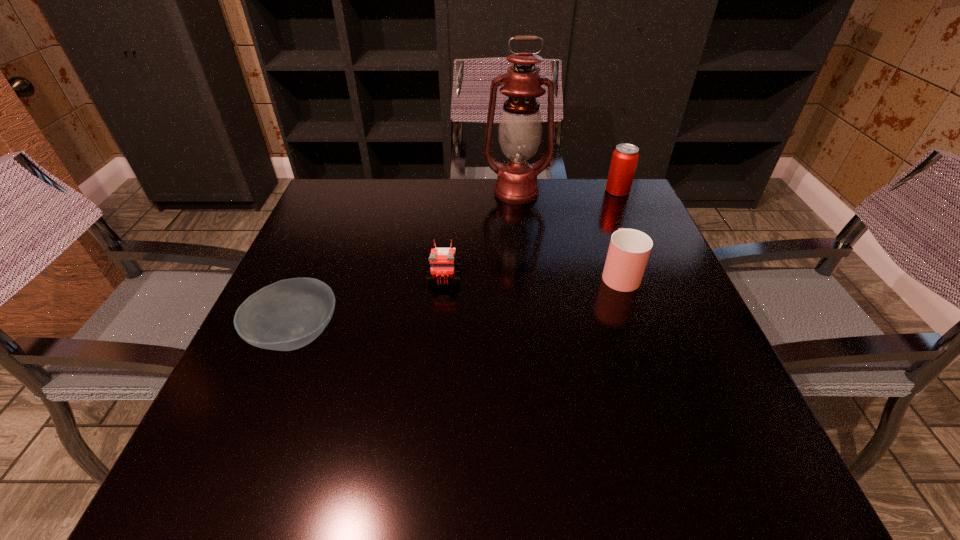
At what (x,y) coordinates should I click in order to perform the action: click on free point between the second object from right to left and the nearest object. Please return your answer as a coordinate pair (x, y). Looking at the image, I should click on (458, 304).

The width and height of the screenshot is (960, 540). Identify the location of vacant point located between the fourth shortest object and the oil lamp. (567, 192).

Identify the location of vacant region between the second object from left to right and the tallest object. (480, 234).

At what (x,y) coordinates should I click in order to perform the action: click on free area in between the fourth object from right to left and the nearest object. Please return your answer as a coordinate pair (x, y). This screenshot has height=540, width=960. Looking at the image, I should click on (371, 306).

Find the location of a particular element. The height and width of the screenshot is (540, 960). free spot between the bowl and the third object from right to left is located at coordinates (406, 264).

This screenshot has width=960, height=540. Identify the location of free space between the tallest object and the Lego. (480, 234).

The image size is (960, 540). I want to click on free space that is in between the nearest object and the third shortest object, so click(458, 304).

Identify the location of object that is the fourth closest to the second tallest object. This screenshot has width=960, height=540. (289, 314).

Point out which object is positioned as the fourth nearest to the Lego. Please provide its 2D coordinates. Your answer should be formatted as a tuple, i.e. [(x, y)], where the tuple contains the x and y coordinates of a point satisfying the conditions above.

[(625, 157)]

Identify the location of vacant space that satisfies the following two spatial constraints: 1. on the side of the fourth shortest object with the handle; 2. on the right side of the second object from right to left. This screenshot has height=540, width=960. (590, 191).